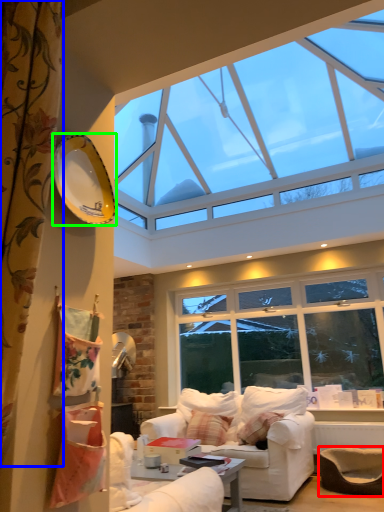
Question: Estimate the real-world distances between objects in this image. Which object is farther from armchair (highlighted by a red box), curtain (highlighted by a blue box) or plate (highlighted by a green box)?

Choices:
 (A) curtain
 (B) plate

Answer: (A)